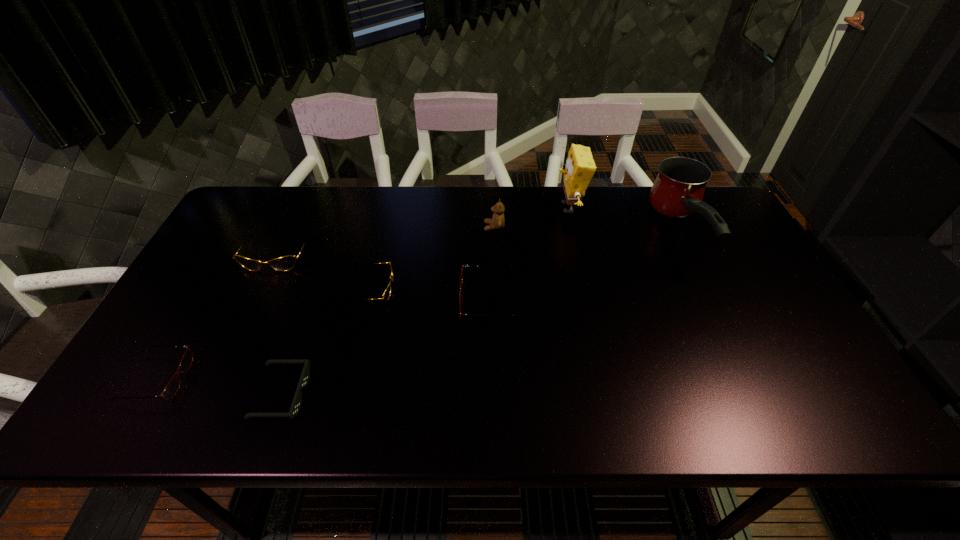
Where is `teddy bear present at the far edge`? teddy bear present at the far edge is located at coordinates (498, 221).

Find the location of a particular element. This screenshot has height=540, width=960. spectacles present at the near edge is located at coordinates (171, 389).

Where is `sunglasses at the near edge`? sunglasses at the near edge is located at coordinates (305, 375).

Locate an element on the screen. This screenshot has height=540, width=960. object that is at the right edge is located at coordinates (678, 190).

This screenshot has height=540, width=960. What are the coordinates of `object that is positioned at the near left corner` in the screenshot? It's located at (171, 389).

Locate an element on the screen. The width and height of the screenshot is (960, 540). object that is at the far right corner is located at coordinates (678, 190).

I want to click on vacant region at the far edge of the desktop, so click(397, 190).

Locate an element on the screen. The height and width of the screenshot is (540, 960). free region at the near edge of the desktop is located at coordinates (209, 404).

The image size is (960, 540). In order to click on vacant space at the left edge in this screenshot , I will do `click(129, 377)`.

You are a GUI agent. You are given a task and a screenshot of the screen. Output one action in this format:
    pyautogui.click(x=<x>, y=<y>)
    Task: Click on the free space at the right edge
    
    Given the screenshot: What is the action you would take?
    pyautogui.click(x=709, y=260)